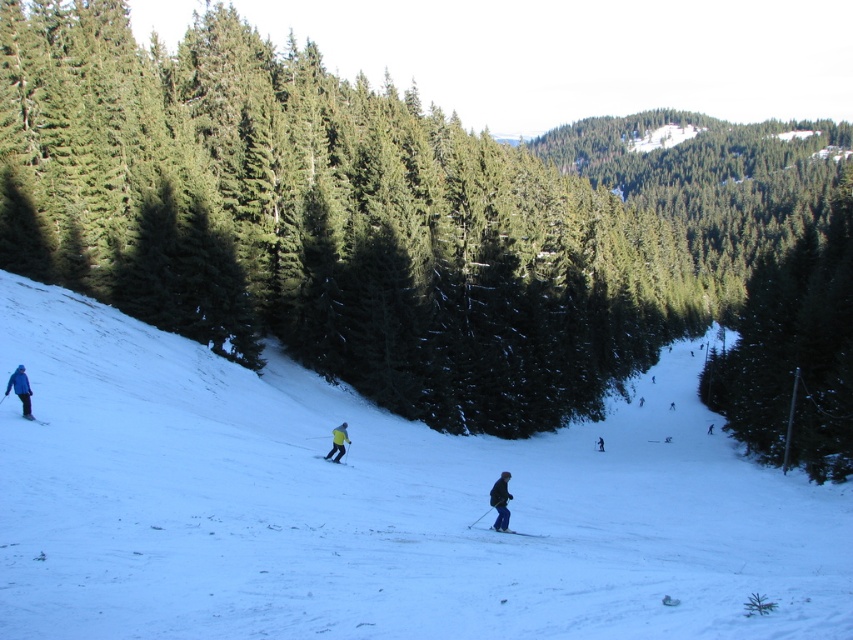
You are a photographer planning to take a photo of the yellow fabric ski at center and the dark blue ski suit at center in the winter scene. Which object should you focus on to ensure it takes up more of the frame?

The dark blue ski suit at center occupies more space than the yellow fabric ski at center, so focusing on it will ensure it takes up more of the frame.

You are a skier planning to navigate from the top of the slope to the bottom. There is a point marked at coordinates point (375,506). What is the terrain like at this point?

The terrain at point (375,506) is white snow at center, which is flat and safe for skiing.